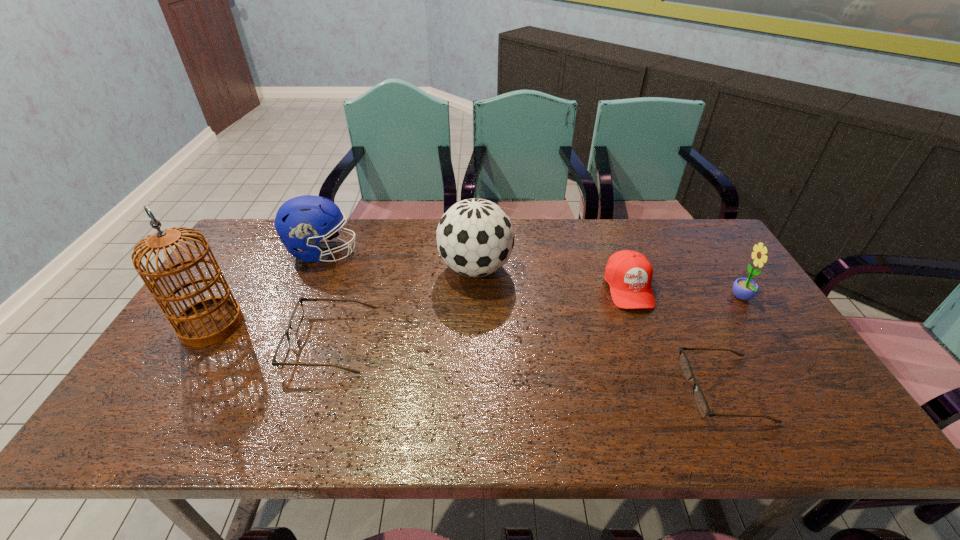
This screenshot has width=960, height=540. Find the location of `free space located 0.330m on the front-facing side of the rightmost object`. free space located 0.330m on the front-facing side of the rightmost object is located at coordinates (616, 298).

The height and width of the screenshot is (540, 960). In order to click on free space located 0.120m on the front-facing side of the rightmost object in this screenshot , I will do [x=689, y=298].

At what (x,y) coordinates should I click in order to perform the action: click on blank space located on the front-facing side of the rightmost object. Please return your answer as a coordinate pair (x, y). This screenshot has height=540, width=960. Looking at the image, I should click on (620, 298).

Find the location of a particular element. soccer ball situated at the far edge is located at coordinates (475, 237).

At what (x,y) coordinates should I click in order to perform the action: click on football helmet that is at the far edge. Please return your answer as a coordinate pair (x, y). Looking at the image, I should click on (301, 222).

I want to click on object that is at the left edge, so click(210, 320).

Identify the location of spectacles at the right edge. The height and width of the screenshot is (540, 960). point(699,398).

Image resolution: width=960 pixels, height=540 pixels. I want to click on sunflower at the right edge, so click(743, 288).

Where is `object that is at the near right corner`? The width and height of the screenshot is (960, 540). object that is at the near right corner is located at coordinates (699, 398).

Locate an element on the screen. The height and width of the screenshot is (540, 960). free space at the far edge is located at coordinates (571, 260).